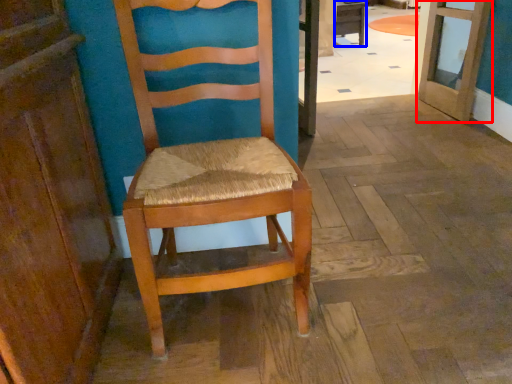
Question: Which object is further to the camera taking this photo, door (highlighted by a red box) or table (highlighted by a blue box)?

Choices:
 (A) door
 (B) table

Answer: (B)